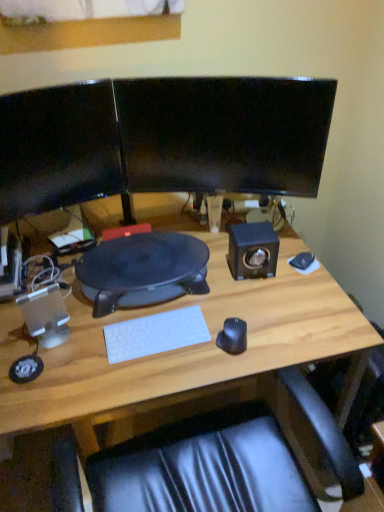
What do you see at coordinates (233, 336) in the screenshot? I see `black matte mouse at center` at bounding box center [233, 336].

Measure the distance between point (16, 300) and camera.

Point (16, 300) and camera are 4.01 feet apart from each other.

Locate an element on the screen. Image resolution: width=384 pixels, height=512 pixels. matte black speaker at right, positioned as the 2th speaker in front-to-back order is located at coordinates (252, 250).

Image resolution: width=384 pixels, height=512 pixels. Describe the element at coordinates (252, 250) in the screenshot. I see `matte black speaker at right, which is the 1th speaker in top-to-bottom order` at that location.

Where is `black matte mouse at center`? The width and height of the screenshot is (384, 512). black matte mouse at center is located at coordinates (233, 336).

In the scene shown: Is white matte keyboard at center not close to matte black monitor at left, acting as the 1th computer monitor starting from the left?

white matte keyboard at center is near matte black monitor at left, acting as the 1th computer monitor starting from the left, not far away.

From the picture: From a real-world perspective, is white matte keyboard at center above or below matte black monitor at left, acting as the 1th computer monitor starting from the left?

Clearly, from a real-world perspective, white matte keyboard at center is below matte black monitor at left, acting as the 1th computer monitor starting from the left.

Considering the positions of objects white matte keyboard at center and matte black monitor at left, which is the second computer monitor from right to left, in the image provided, who is behind, white matte keyboard at center or matte black monitor at left, which is the second computer monitor from right to left,?

Positioned behind is white matte keyboard at center.

Does point (179, 321) lie in front of point (54, 131)?

Yes, it is in front of point (54, 131).

From the image's perspective, which object appears higher, white plastic speaker at left, which is counted as the first speaker, starting from the bottom, or white matte mousepad at right?

white matte mousepad at right, from the image's perspective.

From the picture: Is the surface of white plastic speaker at left, arranged as the 1th speaker when viewed from the front, in direct contact with white matte mousepad at right?

No, white plastic speaker at left, arranged as the 1th speaker when viewed from the front, is not making contact with white matte mousepad at right.

In the scene shown: Does white plastic speaker at left, placed as the 2th speaker when sorted from top to bottom, have a lesser width compared to white matte mousepad at right?

Yes, white plastic speaker at left, placed as the 2th speaker when sorted from top to bottom, is thinner than white matte mousepad at right.

Between white plastic speaker at left, the first speaker in the left-to-right sequence, and white matte mousepad at right, which one has larger size?

Bigger between the two is white plastic speaker at left, the first speaker in the left-to-right sequence.

Is white plastic speaker at left, the second speaker viewed from the right, taller than black matte mouse at center?

Yes, white plastic speaker at left, the second speaker viewed from the right, is taller than black matte mouse at center.

Where is `speaker that is the 1st object located above the black matte mouse at center (from the image's perspective)`? Image resolution: width=384 pixels, height=512 pixels. speaker that is the 1st object located above the black matte mouse at center (from the image's perspective) is located at coordinates coord(45,315).

Can you see white plastic speaker at left, the first speaker in the left-to-right sequence, touching black matte mouse at center?

They are not placed beside each other.

Does white plastic speaker at left, placed as the second speaker when sorted from back to front, have a smaller size compared to black matte mouse at center?

No.

From the picture: Is wooden desk at center smaller than matte black monitor at left, acting as the 1th computer monitor starting from the left?

Actually, wooden desk at center might be larger than matte black monitor at left, acting as the 1th computer monitor starting from the left.

Consider the image. Can you tell me how much wooden desk at center and matte black monitor at left, which is the second computer monitor from right to left, differ in facing direction?

19.4 degrees.

How far apart are wooden desk at center and matte black monitor at left, which is the second computer monitor from right to left?

They are 18.98 inches apart.

Does wooden desk at center touch matte black monitor at left, acting as the 1th computer monitor starting from the left?

They are not placed beside each other.

Which is behind, point (261, 224) or point (301, 269)?

The point (301, 269) is behind.

Is white matte mousepad at right at the back of matte black speaker at right, which is the 1th speaker in top-to-bottom order?

No, matte black speaker at right, which is the 1th speaker in top-to-bottom order, is not facing the opposite direction of white matte mousepad at right.

Can you confirm if matte black speaker at right, placed as the 1th speaker when sorted from right to left, is thinner than white matte mousepad at right?

No.

Which is more to the left, matte black speaker at right, the second speaker in the bottom-to-top sequence, or white matte mousepad at right?

From the viewer's perspective, matte black speaker at right, the second speaker in the bottom-to-top sequence, appears more on the left side.

Is black matte mouse at center looking in the opposite direction of matte black monitor at left, which is the second computer monitor from right to left?

No, matte black monitor at left, which is the second computer monitor from right to left, is not at the back of black matte mouse at center.

Is black matte mouse at center to the left of matte black monitor at left, which is the second computer monitor from right to left, from the viewer's perspective?

In fact, black matte mouse at center is to the right of matte black monitor at left, which is the second computer monitor from right to left.

Considering the sizes of black matte mouse at center and matte black monitor at left, which is the second computer monitor from right to left, in the image, is black matte mouse at center bigger or smaller than matte black monitor at left, which is the second computer monitor from right to left,?

Clearly, black matte mouse at center is smaller in size than matte black monitor at left, which is the second computer monitor from right to left.

Is black matte mouse at center at the back of matte black monitor at left, which is the second computer monitor from right to left?

That's not correct — matte black monitor at left, which is the second computer monitor from right to left, is not looking away from black matte mouse at center.

Considering the points (63, 102) and (240, 344), which point is behind, point (63, 102) or point (240, 344)?

The point (63, 102) is farther from the camera.

Which object is positioned more to the left, matte black monitor at left, acting as the 1th computer monitor starting from the left, or black matte mouse at center?

From the viewer's perspective, matte black monitor at left, acting as the 1th computer monitor starting from the left, appears more on the left side.

Identify the location of computer monitor on the left side of white matte keyboard at center. The image size is (384, 512). (57, 148).

Where is `mousepad that appears below the white plastic speaker at left, placed as the 2th speaker when sorted from top to bottom (from a real-world perspective)`? The height and width of the screenshot is (512, 384). mousepad that appears below the white plastic speaker at left, placed as the 2th speaker when sorted from top to bottom (from a real-world perspective) is located at coordinates (304, 263).

In the scene shown: When comparing their distances from black matte mouse at center, does white plastic speaker at left, the first speaker in the left-to-right sequence, or white matte keyboard at center seem further?

white plastic speaker at left, the first speaker in the left-to-right sequence, is positioned further to the anchor black matte mouse at center.

When comparing their distances from white matte keyboard at center, does wooden desk at center or glossy black monitor at upper center, the second computer monitor viewed from the left, seem closer?

wooden desk at center lies closer to white matte keyboard at center than the other object.

Considering their positions, is wooden desk at center positioned further to matte black monitor at left, which is the second computer monitor from right to left, than white matte mousepad at right?

white matte mousepad at right is positioned further to the anchor matte black monitor at left, which is the second computer monitor from right to left.

Based on their spatial positions, is black matte mouse at center or glossy black monitor at upper center, the second computer monitor viewed from the left, closer to matte black monitor at left, which is the second computer monitor from right to left?

Among the two, glossy black monitor at upper center, the second computer monitor viewed from the left, is located nearer to matte black monitor at left, which is the second computer monitor from right to left.

Based on their spatial positions, is white matte keyboard at center or matte black speaker at right, positioned as the 2th speaker in front-to-back order, further from black rubberized desk at center?

matte black speaker at right, positioned as the 2th speaker in front-to-back order, is positioned further to the anchor black rubberized desk at center.

When comparing their distances from white matte keyboard at center, does black rubberized desk at center or white plastic speaker at left, placed as the second speaker when sorted from back to front, seem further?

white plastic speaker at left, placed as the second speaker when sorted from back to front, is positioned further to the anchor white matte keyboard at center.

Looking at this image, considering their positions, is black matte mouse at center positioned closer to white matte keyboard at center than wooden desk at center?

Based on the image, black matte mouse at center appears to be nearer to white matte keyboard at center.

Which object lies further to the anchor point matte black speaker at right, placed as the 1th speaker when sorted from right to left, wooden desk at center or white matte mousepad at right?

wooden desk at center is further to matte black speaker at right, placed as the 1th speaker when sorted from right to left.

This screenshot has height=512, width=384. What are the coordinates of `desktop between white plastic speaker at left, which is counted as the first speaker, starting from the bottom, and black matte mouse at center from left to right` in the screenshot? It's located at (142, 270).

At what (x,y) coordinates should I click in order to perform the action: click on mouse between matte black monitor at left, acting as the 1th computer monitor starting from the left, and wooden desk at center in the up-down direction. Please return your answer as a coordinate pair (x, y). The image size is (384, 512). Looking at the image, I should click on (233, 336).

This screenshot has height=512, width=384. What are the coordinates of `computer keyboard between glossy black monitor at upper center, which is the first computer monitor in right-to-left order, and black matte mouse at center vertically` in the screenshot? It's located at (155, 334).

The image size is (384, 512). I want to click on speaker situated between wooden desk at center and white matte mousepad at right from left to right, so click(x=252, y=250).